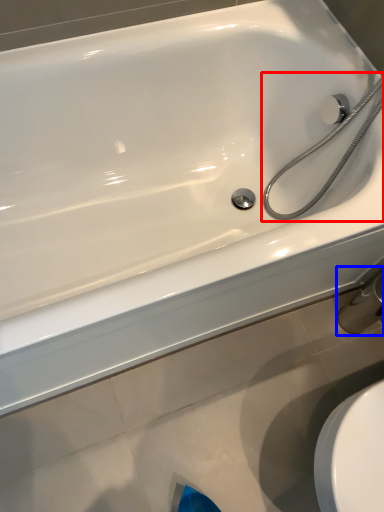
Question: Which object appears closest to the camera in this image, shower (highlighted by a red box) or faucet (highlighted by a blue box)?

Choices:
 (A) shower
 (B) faucet

Answer: (A)